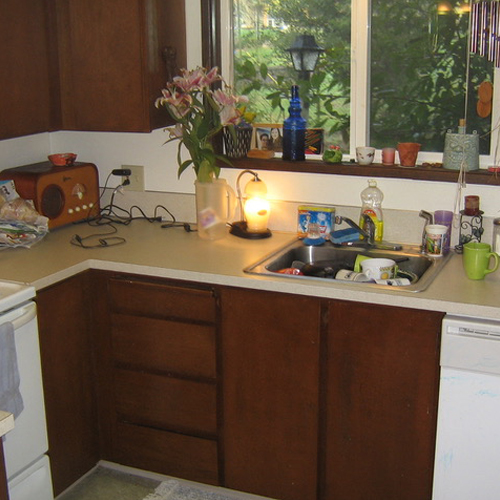
Where is `edge of counter`? Image resolution: width=500 pixels, height=500 pixels. edge of counter is located at coordinates (10, 421).